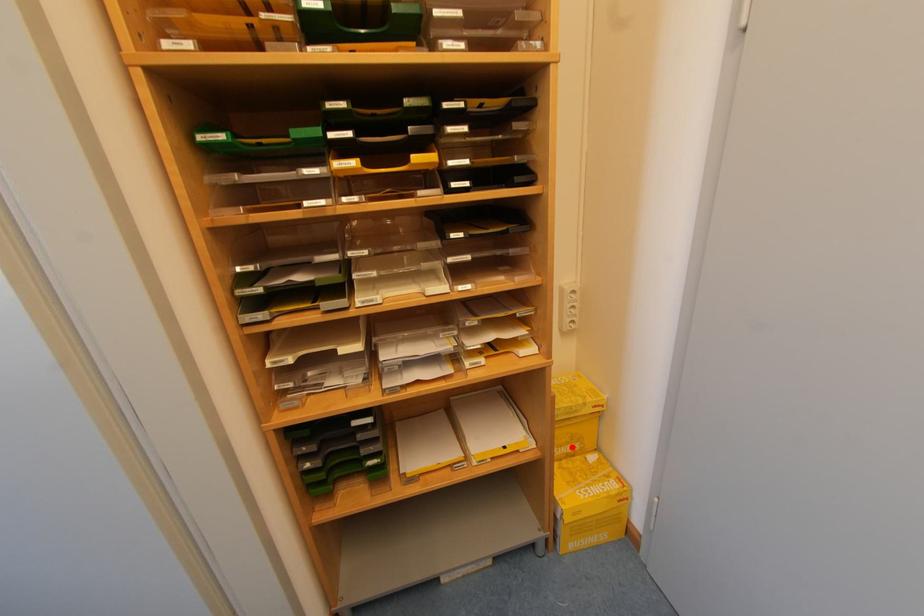
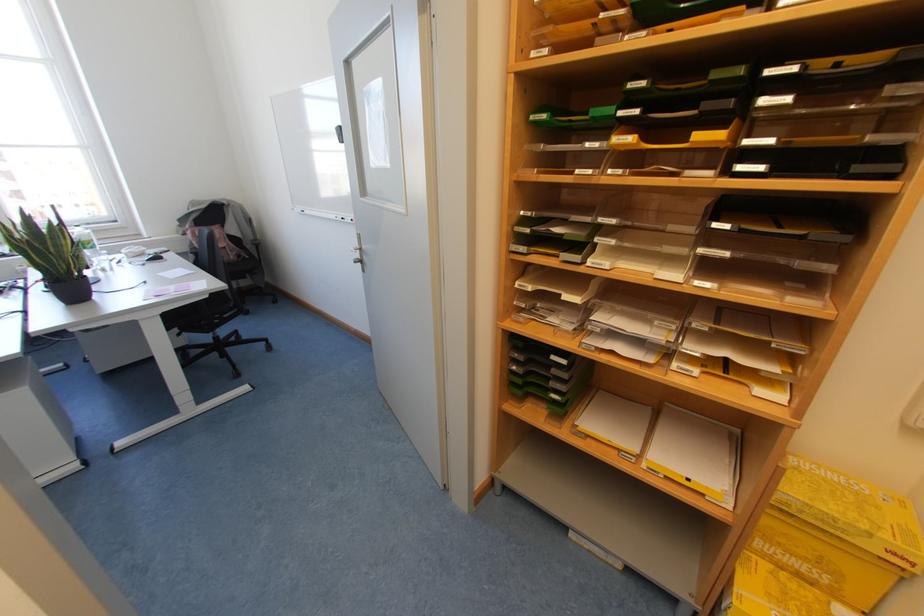
Where in the second image is the point corresponding to the highlighted location from the first image?

(813, 573)